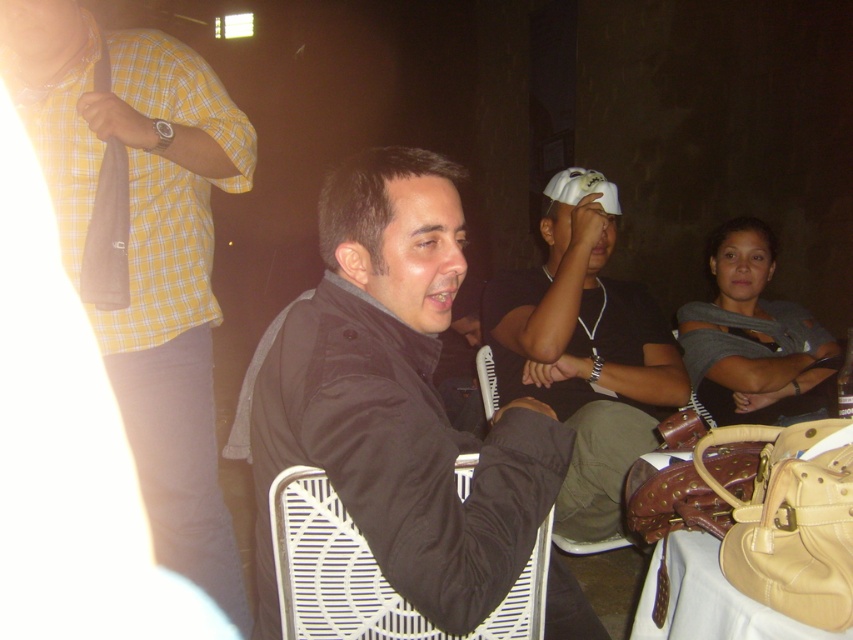
Question: Which point is closer to the camera taking this photo?

Choices:
 (A) (730, 422)
 (B) (173, 218)
 (C) (274, 605)

Answer: (C)

Question: Does yellow checkered shirt at upper left have a smaller size compared to white plastic chair at center?

Choices:
 (A) yes
 (B) no

Answer: (B)

Question: Is gray fabric shirt at upper right behind beige leather table at lower right?

Choices:
 (A) no
 (B) yes

Answer: (B)

Question: Which object appears farthest from the camera in this image?

Choices:
 (A) gray fabric shirt at upper right
 (B) beige leather table at lower right
 (C) white matte cap at center

Answer: (A)

Question: Does white plastic chair at center appear over beige leather table at lower right?

Choices:
 (A) yes
 (B) no

Answer: (A)

Question: Among these objects, which one is nearest to the camera?

Choices:
 (A) beige leather table at lower right
 (B) yellow checkered shirt at upper left
 (C) gray fabric shirt at upper right

Answer: (A)